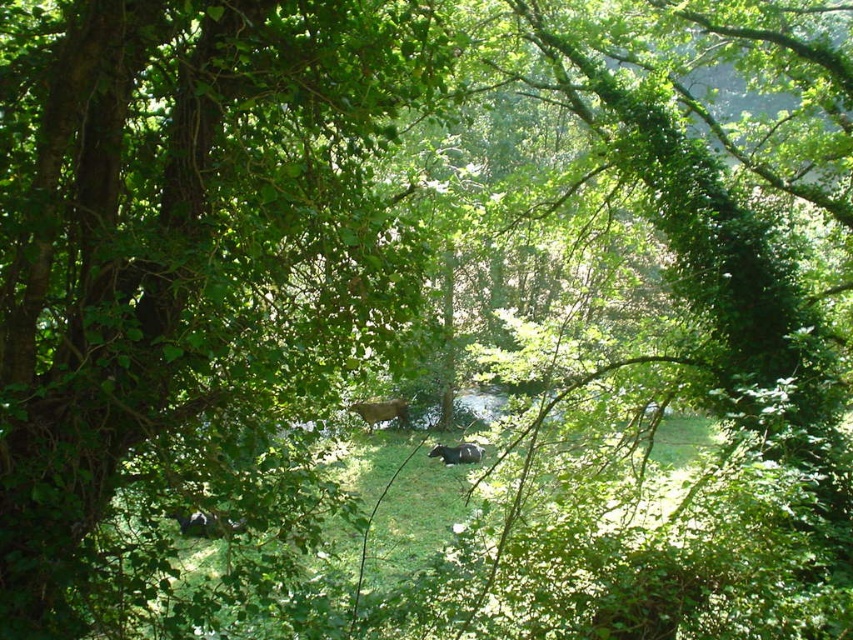
You are a photographer trying to capture both the green leafy tree at center and the brown fur cow at center in a single frame. Based on their widths, which one should you focus on to ensure both fit in the photo?

The green leafy tree at center is wider than the brown fur cow at center, so you should focus on capturing the tree first to ensure both fit in the photo.

You are a photographer trying to capture both the brown fur cow at center and the shiny black bear at center in the same frame. Which animal should you adjust your camera to focus on first if you want to include both in your shot?

The brown fur cow at center is positioned on the left side of shiny black bear at center, so you should focus on the shiny black bear at center first to ensure both are in frame.